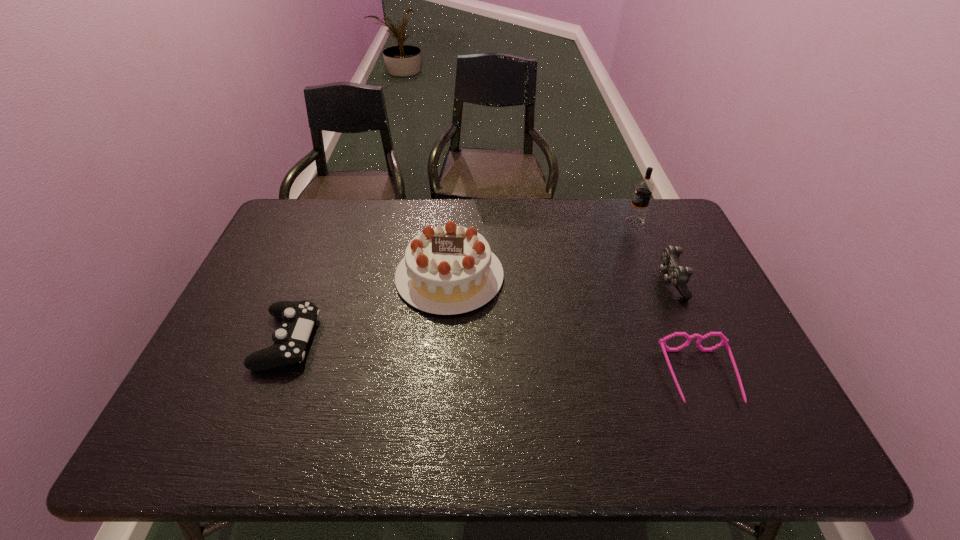
Locate an element on the screen. free spot located 0.390m on the label of the tallest object is located at coordinates (511, 221).

Where is `vacant region located on the label of the tallest object`? The height and width of the screenshot is (540, 960). vacant region located on the label of the tallest object is located at coordinates (585, 221).

Identify the location of vacant area located 0.210m on the front of the second object from left to right. (442, 384).

The width and height of the screenshot is (960, 540). What are the coordinates of `vacant space situated on the surface of the right control with buttons` in the screenshot? It's located at (588, 282).

Where is `blank space located 0.130m on the surface of the right control with buttons`? This screenshot has width=960, height=540. blank space located 0.130m on the surface of the right control with buttons is located at coordinates point(614,282).

Identify the location of free space located on the surface of the right control with buttons. (614, 282).

Where is `blank space located on the surface of the nearer control`? blank space located on the surface of the nearer control is located at coordinates (469, 340).

Identify the location of vacant space located 0.050m on the arms of the spectacles. Image resolution: width=960 pixels, height=540 pixels. (722, 428).

The width and height of the screenshot is (960, 540). In order to click on object that is at the far edge in this screenshot , I will do `click(643, 190)`.

The image size is (960, 540). I want to click on object that is at the left edge, so click(x=298, y=317).